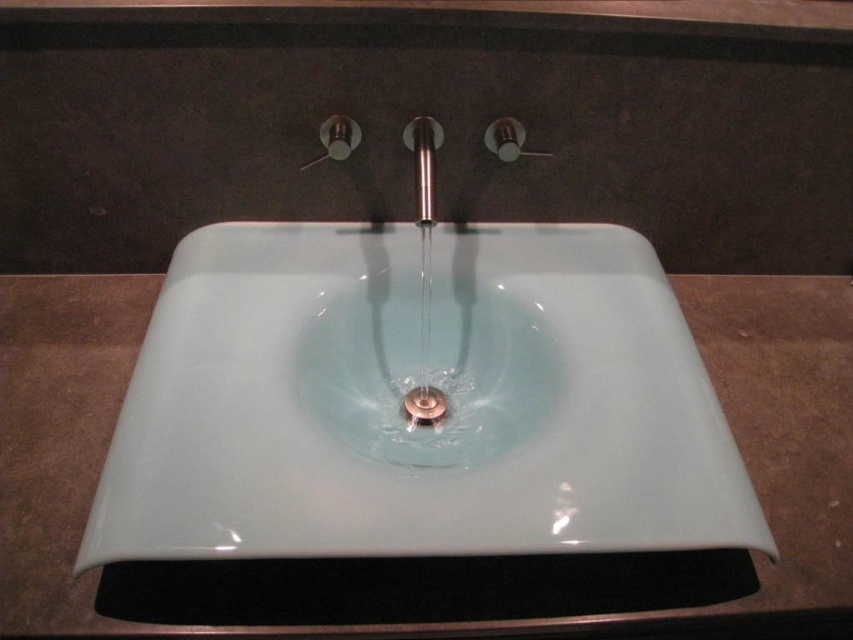
Question: Which object appears closest to the camera in this image?

Choices:
 (A) white glossy sink at center
 (B) polished stainless steel faucet at center

Answer: (A)

Question: Does polished stainless steel faucet at center have a smaller size compared to satin nickel drain at center?

Choices:
 (A) no
 (B) yes

Answer: (A)

Question: Which point is closer to the camera?

Choices:
 (A) (415, 401)
 (B) (425, 188)
 (C) (618, 288)

Answer: (B)

Question: Does polished stainless steel faucet at center appear under satin nickel drain at center?

Choices:
 (A) yes
 (B) no

Answer: (B)

Question: In this image, where is white glossy sink at center located relative to polished stainless steel faucet at center?

Choices:
 (A) right
 (B) left

Answer: (B)

Question: Which point appears farthest from the camera in this image?

Choices:
 (A) (432, 129)
 (B) (409, 417)

Answer: (B)